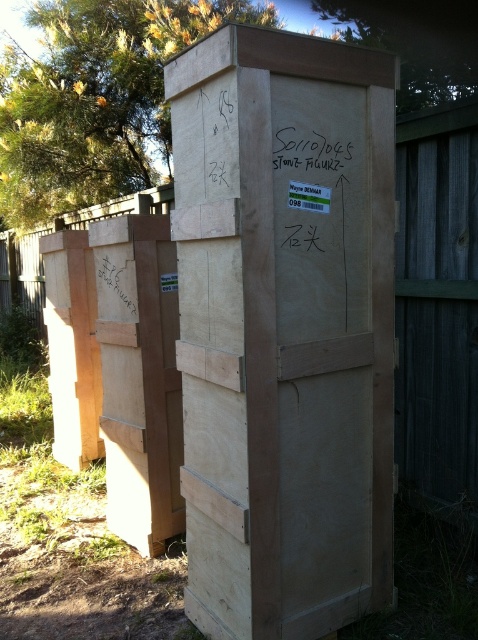
You are a delivery person standing at the camera position. You need to place a package that requires a minimum of 2 meters of space to maneuver. Can you safely maneuver around the natural wood cardboard box at center without hitting it?

The natural wood cardboard box at center and the camera are 2.06 meters apart. Since the required space is 2 meters, you have enough space to maneuver safely around the natural wood cardboard box at center.

You are organizing a warehouse and need to place the natural wood cardboard box at center and the light brown wood at center on a shelf. The shelf can only hold items up to the size of the smaller object. Which object should you place first to ensure both fit?

The natural wood cardboard box at center is larger than the light brown wood at center. To ensure both fit on the shelf, place the light brown wood at center first, then the natural wood cardboard box at center. However, since the shelf can only hold items up to the size of the smaller object, the natural wood cardboard box at center may not fit at all. Please verify the shelf dimensions carefully.

What is the spatial relationship between the natural wood cardboard box at center and the light brown wood at center?

The natural wood cardboard box at center is closer to the viewer than the light brown wood at center.